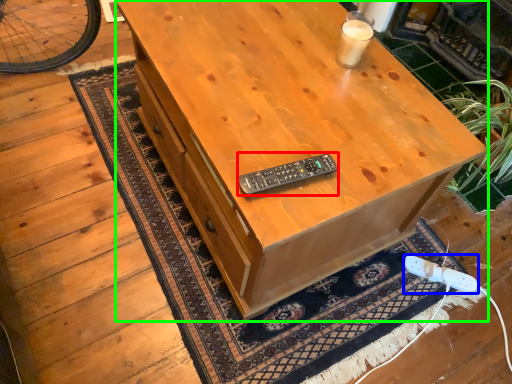
Question: Which object is the closest to the control (highlighted by a red box)? Choose among these: game controller (highlighted by a blue box) or desk (highlighted by a green box).

Choices:
 (A) game controller
 (B) desk

Answer: (B)